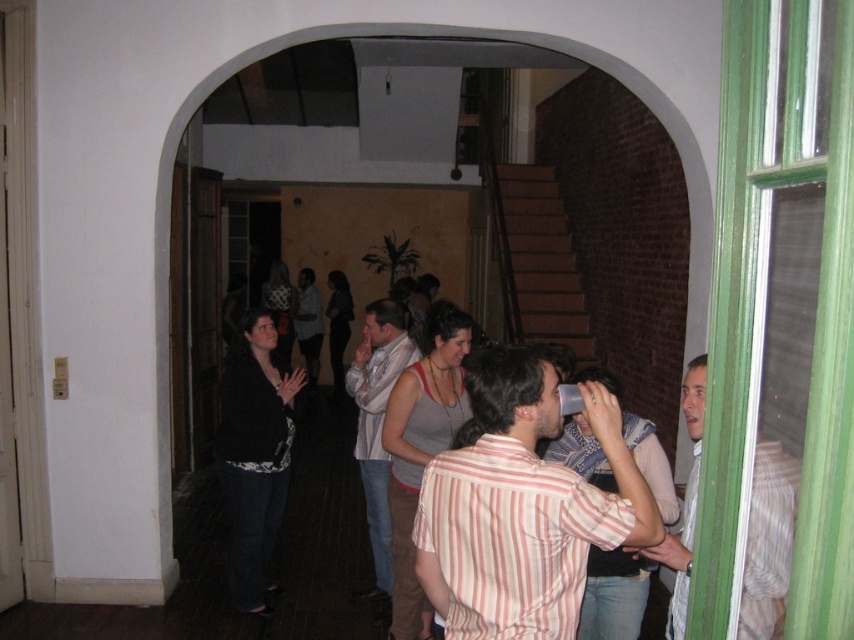
Does striped cotton shirt at center appear under light gray scarf at center?

No.

Does striped cotton shirt at center appear over light gray scarf at center?

Yes, striped cotton shirt at center is above light gray scarf at center.

What are the coordinates of `striped cotton shirt at center` in the screenshot? It's located at (522, 508).

Does point (767, 596) come behind point (376, 595)?

That is False.

Between point (781, 476) and point (360, 436), which one is positioned in front?

Point (781, 476) is more forward.

Locate an element on the screen. light brown striped shirt at right is located at coordinates 768,541.

Based on the photo, between striped cotton shirt at center and light brown striped shirt at right, which one has less height?

striped cotton shirt at center is shorter.

Is striped cotton shirt at center taller than light brown striped shirt at right?

In fact, striped cotton shirt at center may be shorter than light brown striped shirt at right.

Which is in front, point (639, 522) or point (765, 566)?

Point (765, 566) is in front.

You are a GUI agent. You are given a task and a screenshot of the screen. Output one action in this format:
    pyautogui.click(x=<x>, y=<y>)
    Task: Click on the striped cotton shirt at center
    Image resolution: width=854 pixels, height=640 pixels.
    Given the screenshot: What is the action you would take?
    pyautogui.click(x=522, y=508)